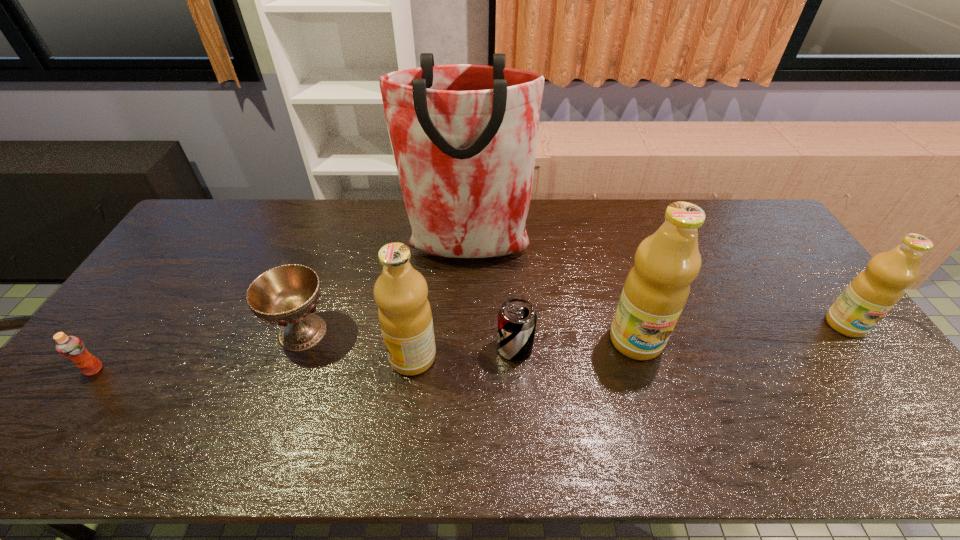
The height and width of the screenshot is (540, 960). Find the location of `free space between the second object from right to left and the soda can`. free space between the second object from right to left and the soda can is located at coordinates (575, 344).

You are a GUI agent. You are given a task and a screenshot of the screen. Output one action in this format:
    pyautogui.click(x=<x>, y=<y>)
    Task: Click on the unoccupied position between the soda can and the orange juice
    The width and height of the screenshot is (960, 540).
    Given the screenshot: What is the action you would take?
    pyautogui.click(x=304, y=359)

The height and width of the screenshot is (540, 960). Identify the location of vacant area that lies between the leftmost object and the soda can. (304, 359).

This screenshot has width=960, height=540. In order to click on vacant space that's between the sixth object from right to left and the fourth shortest object in this screenshot , I will do click(x=574, y=328).

Image resolution: width=960 pixels, height=540 pixels. I want to click on vacant region between the soda can and the leftmost object, so click(304, 359).

The image size is (960, 540). In order to click on free area in between the fifth shortest object and the sixth object from right to left in this screenshot , I will do `click(358, 345)`.

Identify the location of empty location between the leftmost object and the rightmost olive oil. (469, 347).

Select which object appears as the second closest to the rightmost object. Please provide its 2D coordinates. Your answer should be formatted as a tuple, i.e. [(x, y)], where the tuple contains the x and y coordinates of a point satisfying the conditions above.

[(464, 137)]

At what (x,y) coordinates should I click in order to perform the action: click on object that stands as the sixth closest to the leftmost object. Please return your answer as a coordinate pair (x, y). Looking at the image, I should click on (876, 290).

The height and width of the screenshot is (540, 960). Identify the location of the closest olive oil to the second tallest olive oil. (657, 287).